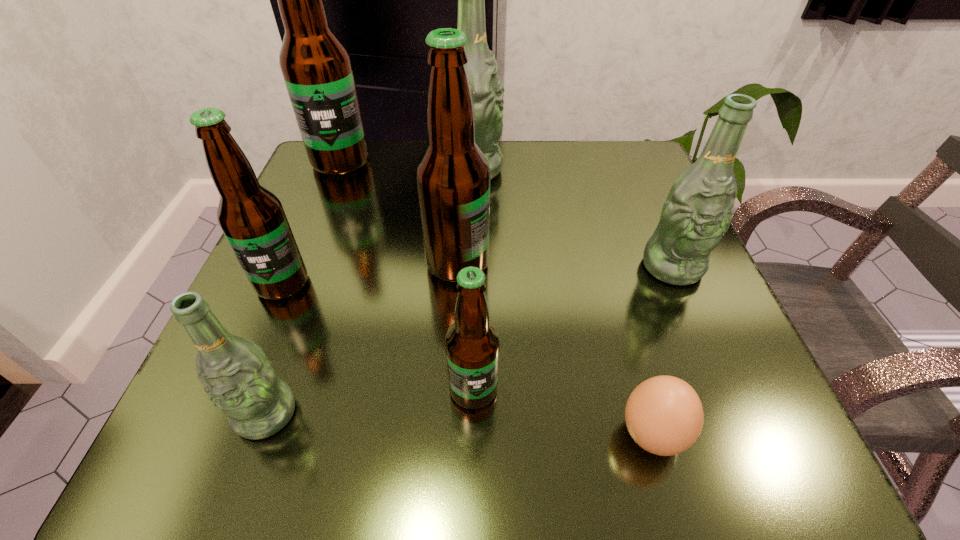
Where is `blank space at the near left corner of the desktop`? Image resolution: width=960 pixels, height=540 pixels. blank space at the near left corner of the desktop is located at coordinates (292, 471).

Locate an element on the screen. The height and width of the screenshot is (540, 960). vacant area at the far right corner is located at coordinates (608, 154).

The width and height of the screenshot is (960, 540). Identify the location of vacant point at the near right corner. (745, 431).

At what (x,y) coordinates should I click in order to perform the action: click on blank region between the second biggest brown beer bottle and the nearest green beer bottle. Please return your answer as a coordinate pair (x, y). The height and width of the screenshot is (540, 960). Looking at the image, I should click on (362, 339).

Where is `unoccupied area between the second smallest brown beer bottle and the nearest brown beer bottle`? This screenshot has width=960, height=540. unoccupied area between the second smallest brown beer bottle and the nearest brown beer bottle is located at coordinates (378, 336).

Where is `free space between the smallest brown beer bottle and the third biggest brown beer bottle`? Image resolution: width=960 pixels, height=540 pixels. free space between the smallest brown beer bottle and the third biggest brown beer bottle is located at coordinates (378, 336).

The width and height of the screenshot is (960, 540). I want to click on vacant area between the second nearest green beer bottle and the second green beer bottle from right to left, so click(573, 218).

Where is `free space between the third smallest brown beer bottle and the rightmost green beer bottle`? free space between the third smallest brown beer bottle and the rightmost green beer bottle is located at coordinates (565, 265).

The image size is (960, 540). In order to click on free space that is in between the farthest green beer bottle and the smallest green beer bottle in this screenshot , I will do point(370,292).

Select which object is the sixth closest to the third biggest brown beer bottle. Please provide its 2D coordinates. Your answer should be formatted as a tuple, i.e. [(x, y)], where the tuple contains the x and y coordinates of a point satisfying the conditions above.

[(664, 415)]